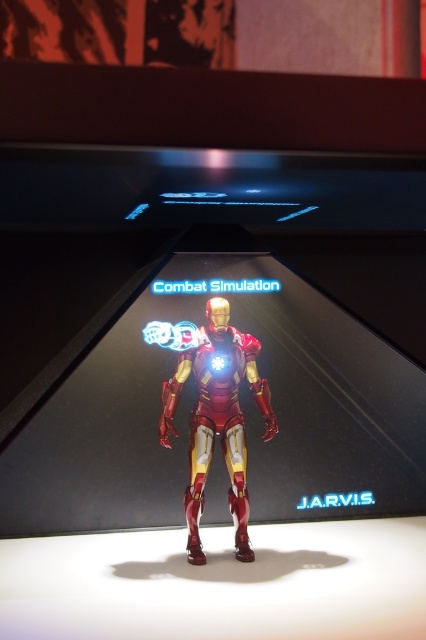
Is metallic iron man at center smaller than shiny metallic iron man at center?

No.

Between metallic iron man at center and shiny metallic iron man at center, which one appears on the left side from the viewer's perspective?

Positioned to the left is metallic iron man at center.

Who is more distant from viewer, (22, 484) or (161, 420)?

The point (22, 484) is more distant.

The height and width of the screenshot is (640, 426). Find the location of `metallic iron man at center`. metallic iron man at center is located at coordinates (226, 412).